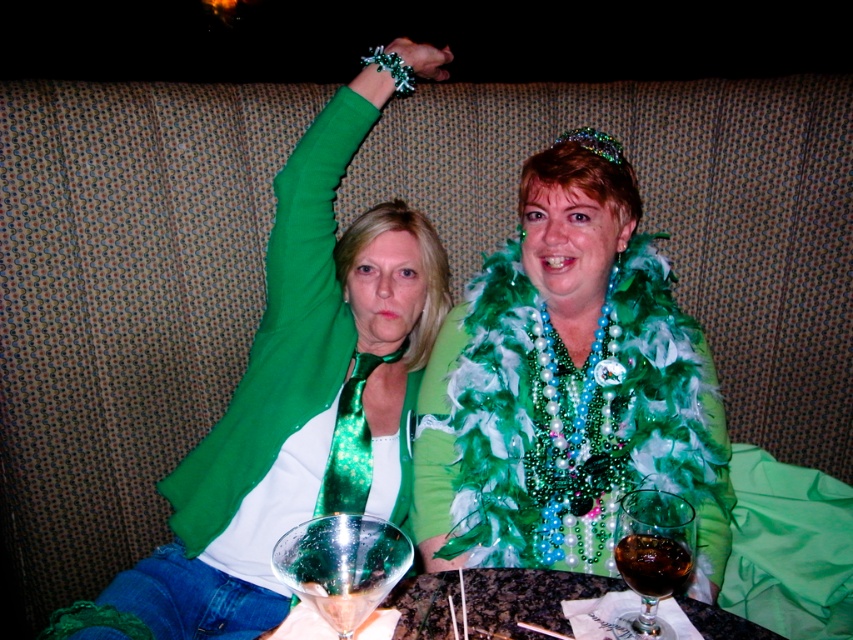
Question: Can you confirm if transparent glass at lower right is positioned to the right of dark glass wine at lower center?

Choices:
 (A) no
 (B) yes

Answer: (B)

Question: Which object is positioned farthest from the transparent glass at lower right?

Choices:
 (A) translucent glass martini glass at center
 (B) dark glass wine at lower center
 (C) matte green scarf at upper center
 (D) shiny green feather boa at center

Answer: (C)

Question: Which object is positioned farthest from the transparent glass at lower right?

Choices:
 (A) translucent glass martini glass at center
 (B) matte green scarf at upper center
 (C) shiny green feather boa at center

Answer: (B)

Question: Is translucent glass martini glass at center to the right of dark glass wine at lower center from the viewer's perspective?

Choices:
 (A) yes
 (B) no

Answer: (B)

Question: Where is transparent glass at lower right located in relation to dark glass wine at lower center in the image?

Choices:
 (A) right
 (B) left

Answer: (A)

Question: Which of the following is the farthest from the observer?

Choices:
 (A) (335, 547)
 (B) (253, 390)
 (C) (666, 566)
 (D) (625, 237)

Answer: (B)